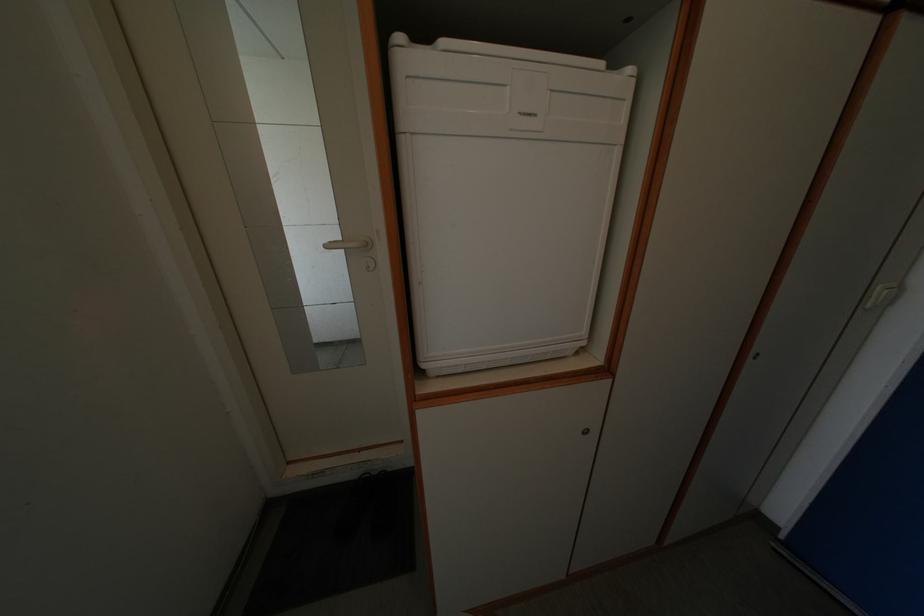
Where would you press the white light switch? Please return your answer as a coordinate pair (x, y).

(528, 100)